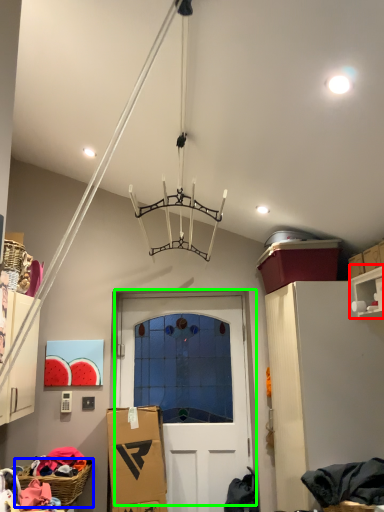
Question: Which is nearer to the shelf (highlighted by a red box)? basket (highlighted by a blue box) or door (highlighted by a green box).

Choices:
 (A) basket
 (B) door

Answer: (B)